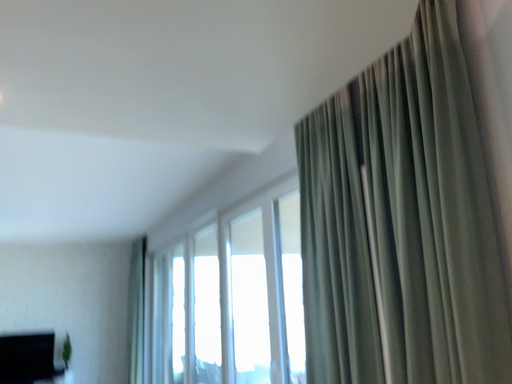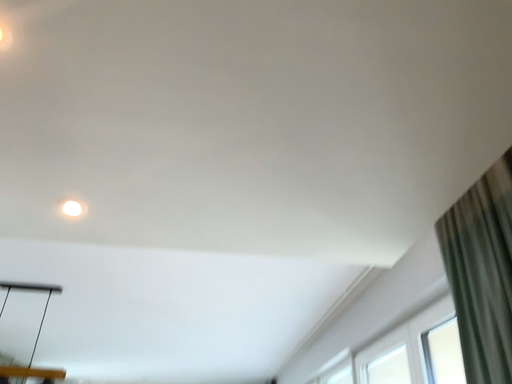
Question: Which way did the camera rotate in the video?

Choices:
 (A) rotated right
 (B) rotated left

Answer: (B)